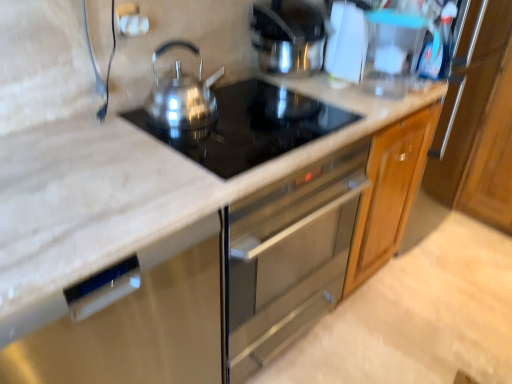
The width and height of the screenshot is (512, 384). I want to click on free point below transparent plastic pitcher at upper right (from a real-world perspective), so click(x=385, y=96).